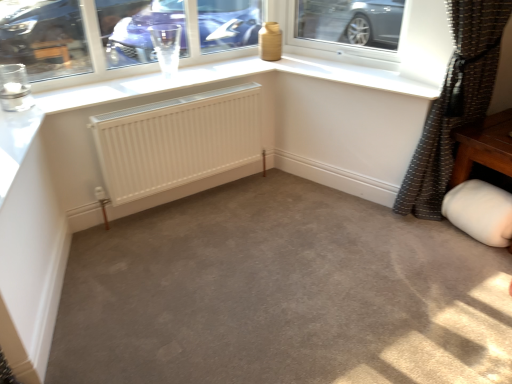
Question: Can you confirm if brown textured curtain at right is wider than white matte radiator at center?

Choices:
 (A) no
 (B) yes

Answer: (B)

Question: Does brown textured curtain at right have a larger size compared to white matte radiator at center?

Choices:
 (A) no
 (B) yes

Answer: (B)

Question: Is brown textured curtain at right smaller than white matte radiator at center?

Choices:
 (A) yes
 (B) no

Answer: (B)

Question: From a real-world perspective, is brown textured curtain at right located beneath white matte radiator at center?

Choices:
 (A) yes
 (B) no

Answer: (B)

Question: From the image's perspective, is brown textured curtain at right located beneath white matte radiator at center?

Choices:
 (A) no
 (B) yes

Answer: (A)

Question: Is brown textured curtain at right next to white matte radiator at center and touching it?

Choices:
 (A) yes
 (B) no

Answer: (B)

Question: Is brown textured curtain at right facing away from white matte jar at lower right?

Choices:
 (A) no
 (B) yes

Answer: (A)

Question: Considering the relative sizes of brown textured curtain at right and white matte jar at lower right in the image provided, is brown textured curtain at right thinner than white matte jar at lower right?

Choices:
 (A) no
 (B) yes

Answer: (A)

Question: Considering the relative sizes of brown textured curtain at right and white matte jar at lower right in the image provided, is brown textured curtain at right bigger than white matte jar at lower right?

Choices:
 (A) no
 (B) yes

Answer: (B)

Question: Is brown textured curtain at right to the right of white matte jar at lower right from the viewer's perspective?

Choices:
 (A) no
 (B) yes

Answer: (A)

Question: Is brown textured curtain at right further to camera compared to white matte jar at lower right?

Choices:
 (A) no
 (B) yes

Answer: (A)

Question: From a real-world perspective, is brown textured curtain at right physically above white matte jar at lower right?

Choices:
 (A) no
 (B) yes

Answer: (B)

Question: Is brown textured curtain at right completely or partially outside of transparent glass at upper center?

Choices:
 (A) no
 (B) yes

Answer: (B)